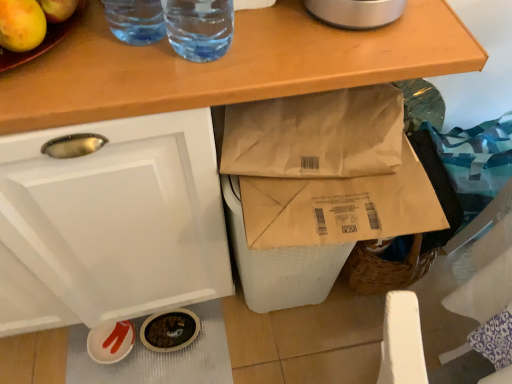
Question: Is transparent plastic straw at upper center, the first drinking straw in the left-to-right sequence, wider or thinner than transparent plastic straw at upper center, which is the 2th drinking straw from left to right?

Choices:
 (A) wide
 (B) thin

Answer: (B)

Question: From a real-world perspective, is transparent plastic straw at upper center, the first drinking straw in the left-to-right sequence, positioned above or below transparent plastic straw at upper center, which is the 2th drinking straw from left to right?

Choices:
 (A) below
 (B) above

Answer: (A)

Question: Considering the positions of transparent plastic straw at upper center, positioned as the second drinking straw in right-to-left order, and transparent plastic straw at upper center, which is the 2th drinking straw from left to right, in the image, is transparent plastic straw at upper center, positioned as the second drinking straw in right-to-left order, bigger or smaller than transparent plastic straw at upper center, which is the 2th drinking straw from left to right,?

Choices:
 (A) small
 (B) big

Answer: (A)

Question: Is point (226, 26) positioned closer to the camera than point (144, 8)?

Choices:
 (A) closer
 (B) farther

Answer: (B)

Question: From a real-world perspective, is transparent plastic straw at upper center, marked as the 1th drinking straw in a right-to-left arrangement, above or below transparent plastic straw at upper center, the first drinking straw in the left-to-right sequence?

Choices:
 (A) below
 (B) above

Answer: (B)

Question: Would you say transparent plastic straw at upper center, marked as the 1th drinking straw in a right-to-left arrangement, is to the left or to the right of transparent plastic straw at upper center, the first drinking straw in the left-to-right sequence, in the picture?

Choices:
 (A) right
 (B) left

Answer: (A)

Question: Is transparent plastic straw at upper center, marked as the 1th drinking straw in a right-to-left arrangement, inside the boundaries of transparent plastic straw at upper center, the first drinking straw in the left-to-right sequence, or outside?

Choices:
 (A) inside
 (B) outside

Answer: (B)